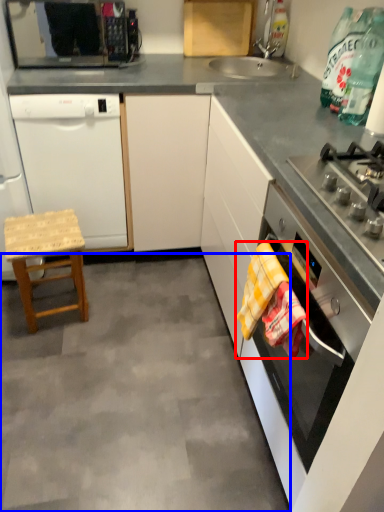
Question: Which point is further to the camera, blanket (highlighted by a red box) or concrete (highlighted by a blue box)?

Choices:
 (A) blanket
 (B) concrete

Answer: (B)